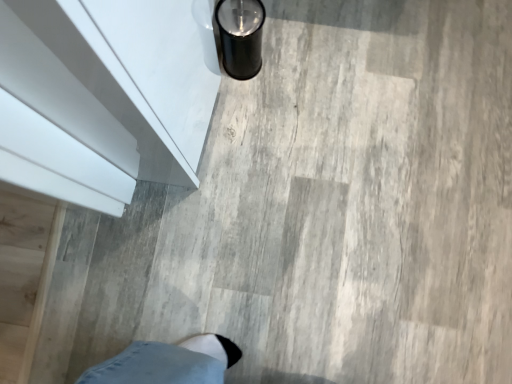
Image resolution: width=512 pixels, height=384 pixels. I want to click on vacant area located to the right-hand side of black matte shoe at lower center, so click(303, 56).